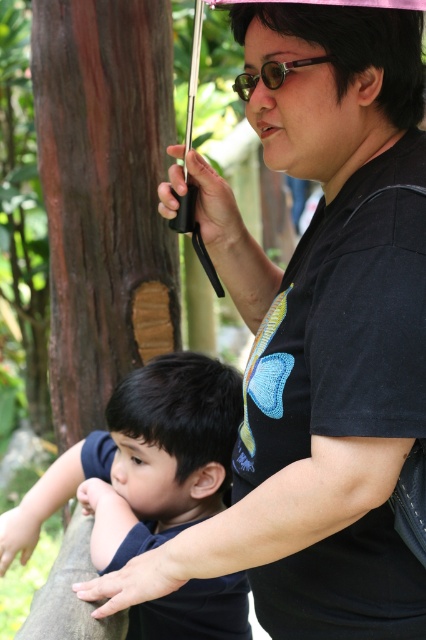
Question: Is dark blue shirt at lower left to the left of pink matte umbrella at upper center from the viewer's perspective?

Choices:
 (A) no
 (B) yes

Answer: (B)

Question: Does dark blue shirt at lower left come behind gold reflective lenses at center?

Choices:
 (A) yes
 (B) no

Answer: (A)

Question: Which point is farther to the camera?

Choices:
 (A) (259, 77)
 (B) (204, 508)

Answer: (B)

Question: Among these objects, which one is farthest from the camera?

Choices:
 (A) pink matte umbrella at upper center
 (B) dark blue shirt at lower left
 (C) gold reflective lenses at center

Answer: (B)

Question: Which object appears closest to the camera in this image?

Choices:
 (A) pink matte umbrella at upper center
 (B) gold reflective lenses at center
 (C) dark blue shirt at lower left

Answer: (A)

Question: Where is dark blue shirt at lower left located in relation to pink matte umbrella at upper center in the image?

Choices:
 (A) right
 (B) left

Answer: (B)